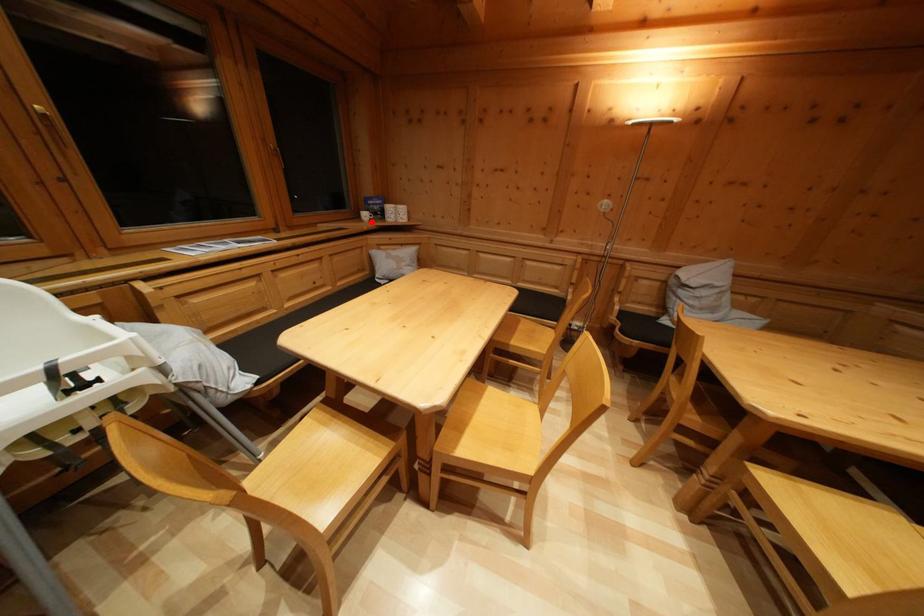
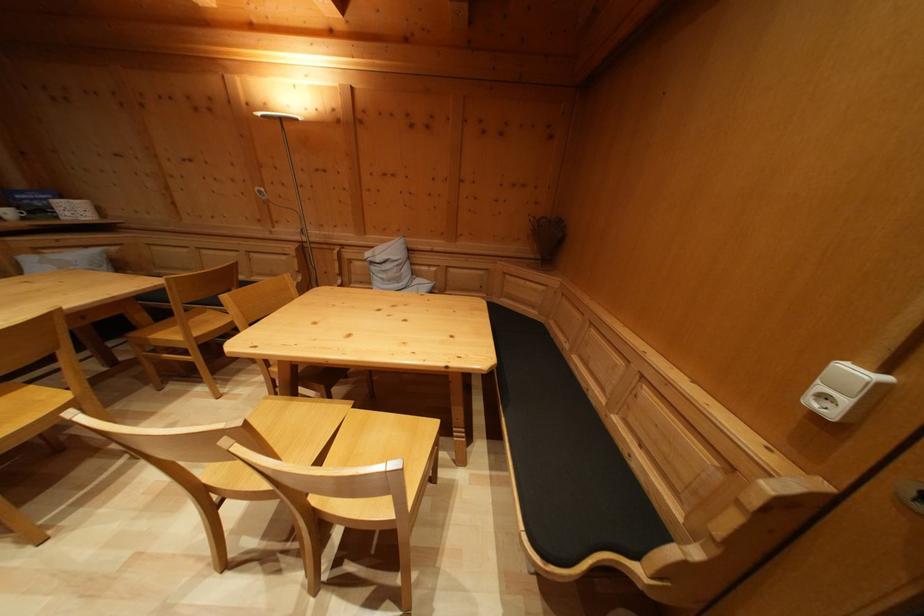
Question: I am providing you with two images of the same scene from different viewpoints. Image1 has a red point marked. In image2, the corresponding 3D location appears at what relative position? Reply with the corresponding letter.

Choices:
 (A) Closer
 (B) Farther

Answer: (B)